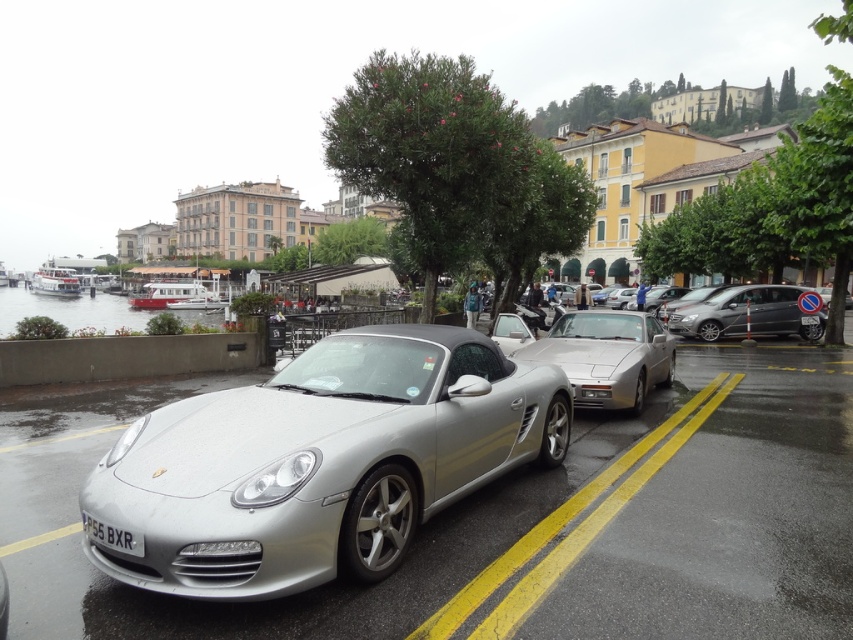
Question: Observing the image, what is the correct spatial positioning of silver metallic convertible at center in reference to metallic silver minivan at right?

Choices:
 (A) right
 (B) left

Answer: (B)

Question: Which object appears farthest from the camera in this image?

Choices:
 (A) black plastic license plate at lower center
 (B) silver metallic sports car at center
 (C) silver metallic convertible at center

Answer: (B)

Question: Which point appears farthest from the camera in this image?

Choices:
 (A) (123, 532)
 (B) (546, 348)
 (C) (730, 547)

Answer: (B)

Question: Is silver metallic sports car at center to the right of black plastic license plate at lower center from the viewer's perspective?

Choices:
 (A) yes
 (B) no

Answer: (A)

Question: Is silver metallic car at center behind metallic silver minivan at right?

Choices:
 (A) no
 (B) yes

Answer: (A)

Question: Which point is farther to the camera?

Choices:
 (A) black plastic license plate at lower center
 (B) silver metallic convertible at center
 (C) metallic silver minivan at right
 (D) silver metallic car at center

Answer: (C)